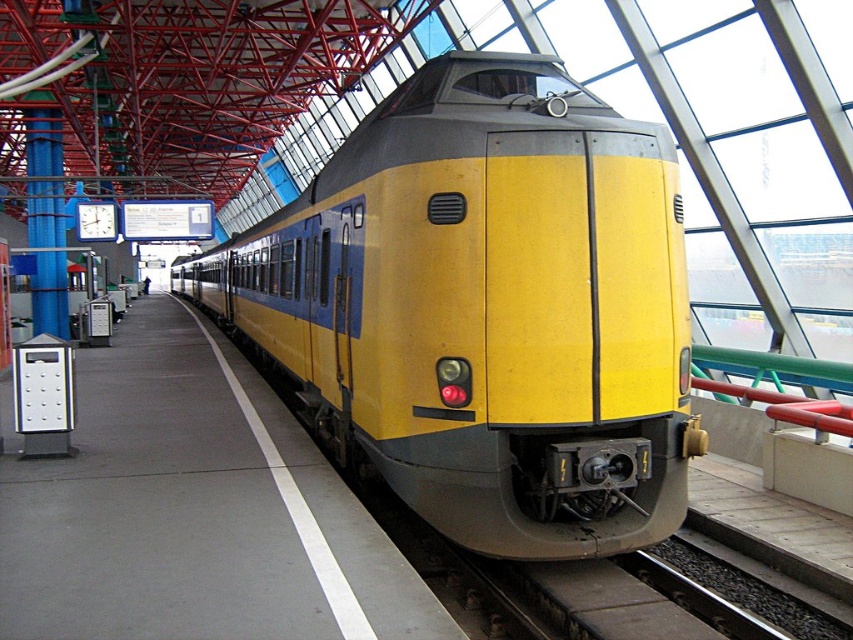
You are standing on the platform of the train station and want to walk from point A to point B. Point A is located at coordinate point A which is point (624, 524) and point B is located at coordinate point B which is point (109, 472). Which point is closer to you when you first arrive at the platform?

Point A is closer to you than point B because point A is closer to the viewer than point B.

You are a passenger waiting on the yellow matte platform at center. You want to board the yellow matte train at center. Can you walk straight ahead from your current position to reach the train?

The yellow matte train at center is wider than the yellow matte platform at center, so yes, you can walk straight ahead from your current position to reach the train because the train extends beyond the platform width, making it accessible from the center.

You are standing at the point marked with coordinates point (486,308) on the platform. Looking around, you see the yellow matte train at center. Based on your position, which direction should you walk to board the train?

The point (486,308) indicates the yellow matte train at center, so you are already at the train. No need to move further.